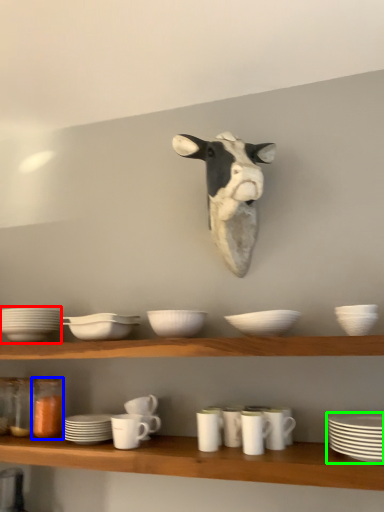
Question: Which is nearer to the tableware (highlighted by a red box)? glass jar (highlighted by a blue box) or platter (highlighted by a green box).

Choices:
 (A) glass jar
 (B) platter

Answer: (A)